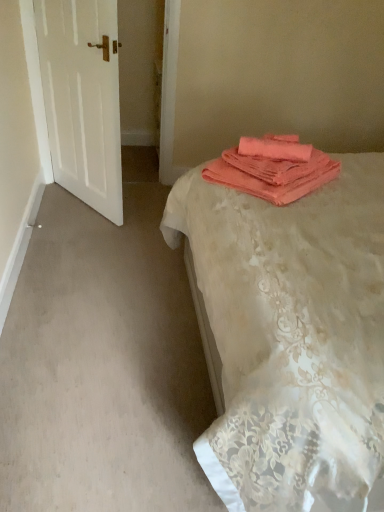
Question: Considering the relative positions of coral fabric bed at center and white matte door at left in the image provided, is coral fabric bed at center to the left or to the right of white matte door at left?

Choices:
 (A) left
 (B) right

Answer: (B)

Question: In terms of height, does coral fabric bed at center look taller or shorter compared to white matte door at left?

Choices:
 (A) short
 (B) tall

Answer: (B)

Question: Which is nearer to the white matte door at left?

Choices:
 (A) coral fabric bed at center
 (B) coral fabric towels at upper right

Answer: (B)

Question: Estimate the real-world distances between objects in this image. Which object is farther from the coral fabric towels at upper right?

Choices:
 (A) white matte door at left
 (B) coral fabric bed at center

Answer: (A)